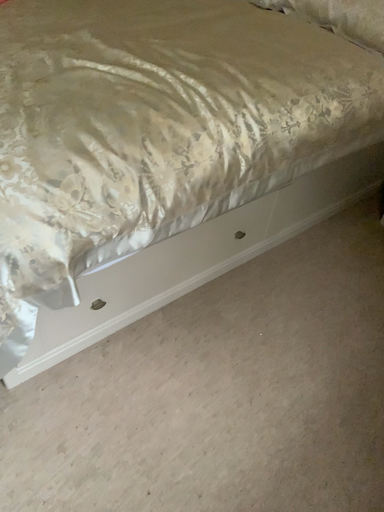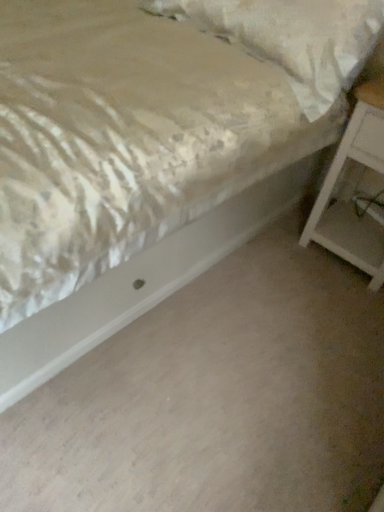
Question: Which way did the camera rotate in the video?

Choices:
 (A) rotated right
 (B) rotated left

Answer: (A)